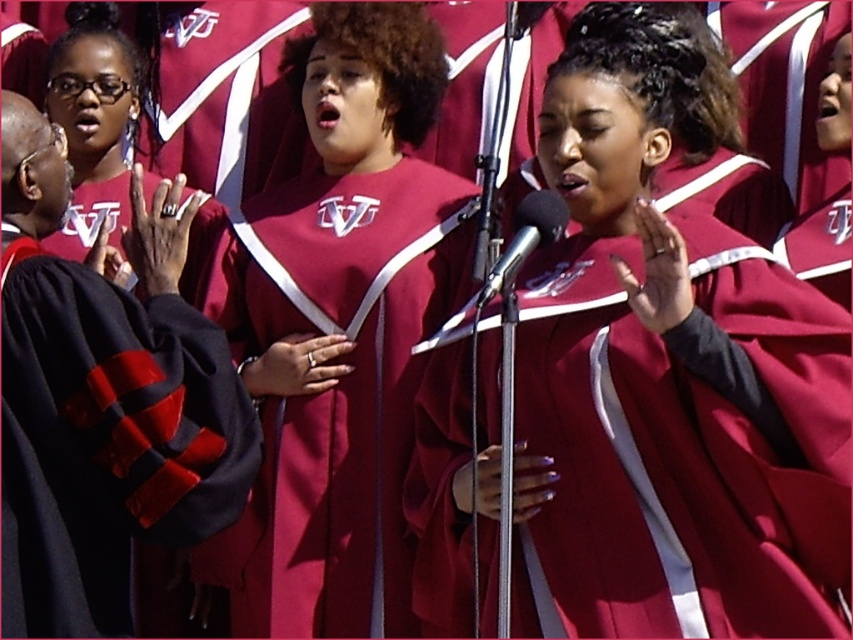
The image size is (853, 640). What do you see at coordinates (123, 419) in the screenshot?
I see `velvet black graduation gown at left` at bounding box center [123, 419].

Is point (113, 532) positioned before point (550, 241)?

No.

Where is `velvet black graduation gown at left`? This screenshot has width=853, height=640. velvet black graduation gown at left is located at coordinates (123, 419).

Is velvet black graduation gown at left positioned in front of matte maroon gown at upper left?

Yes.

Does velvet black graduation gown at left appear on the right side of matte maroon gown at upper left?

Indeed, velvet black graduation gown at left is positioned on the right side of matte maroon gown at upper left.

The image size is (853, 640). I want to click on velvet black graduation gown at left, so click(x=123, y=419).

Can you confirm if maroon fabric choir robe at center is positioned to the left of velvet black graduation gown at left?

In fact, maroon fabric choir robe at center is to the right of velvet black graduation gown at left.

Can you confirm if maroon fabric choir robe at center is positioned above velvet black graduation gown at left?

Yes.

Is point (630, 609) positioned in front of point (120, 477)?

Yes, point (630, 609) is in front of point (120, 477).

At what (x,y) coordinates should I click in order to perform the action: click on maroon fabric choir robe at center. Please return your answer as a coordinate pair (x, y). This screenshot has width=853, height=640. Looking at the image, I should click on (666, 380).